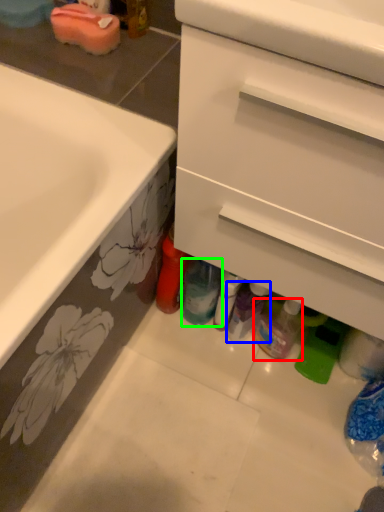
Question: Which is nearer to the bottle (highlighted by a red box)? toiletry (highlighted by a blue box) or bottle (highlighted by a green box).

Choices:
 (A) toiletry
 (B) bottle

Answer: (A)